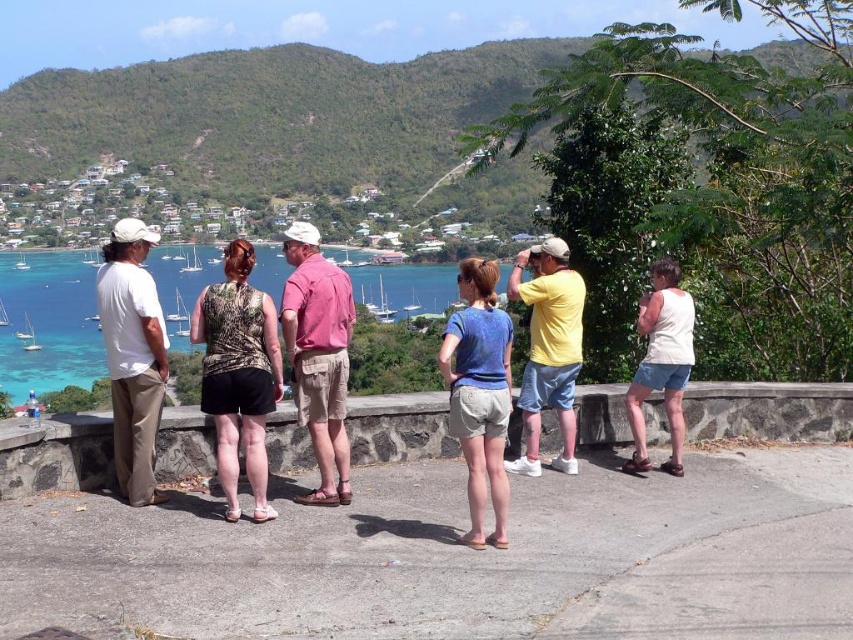
Question: Considering the relative positions of turquoise water at center and camouflage fabric tank top at center in the image provided, where is turquoise water at center located with respect to camouflage fabric tank top at center?

Choices:
 (A) right
 (B) left

Answer: (B)

Question: Which object appears farthest from the camera in this image?

Choices:
 (A) camouflage fabric tank top at center
 (B) turquoise water at center
 (C) white cotton shirt at left
 (D) blue cotton shirt at center

Answer: (C)

Question: Is camouflage fabric tank top at center further to camera compared to blue cotton shirt at center?

Choices:
 (A) yes
 (B) no

Answer: (A)

Question: Is turquoise water at center above white tank top at right?

Choices:
 (A) yes
 (B) no

Answer: (A)

Question: Among these points, which one is nearest to the camera?

Choices:
 (A) (450, 356)
 (B) (675, 333)

Answer: (A)

Question: Which of these objects is positioned farthest from the white tank top at right?

Choices:
 (A) turquoise water at center
 (B) camouflage fabric tank top at center
 (C) blue cotton shirt at center
 (D) white cotton shirt at left

Answer: (A)